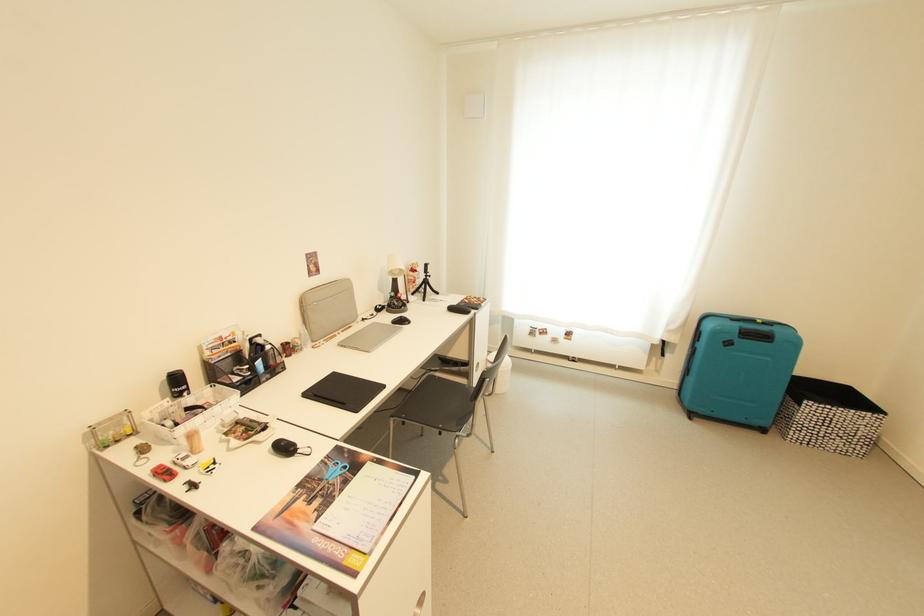
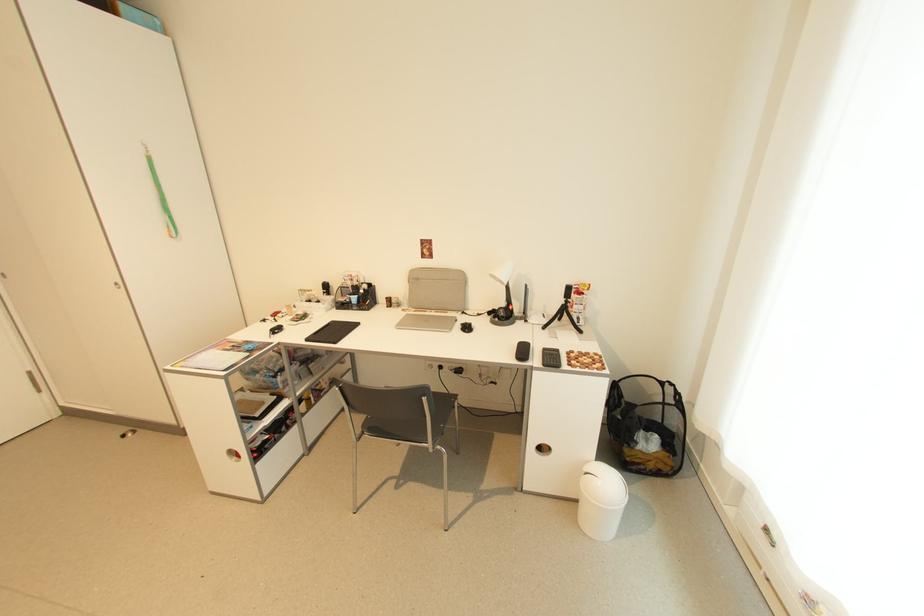
Find the pixel in the second image that matches the point at 432,278 in the first image.

(572, 302)